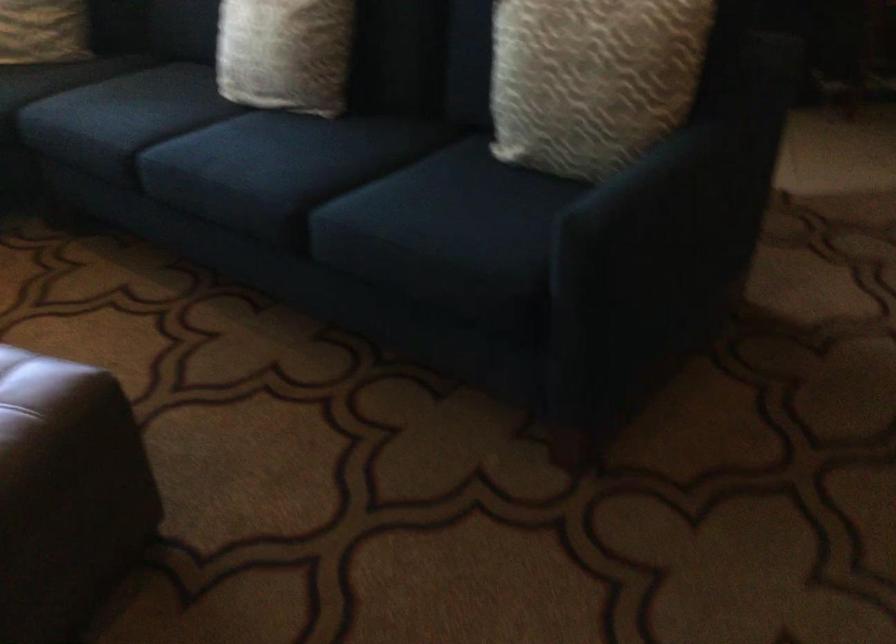
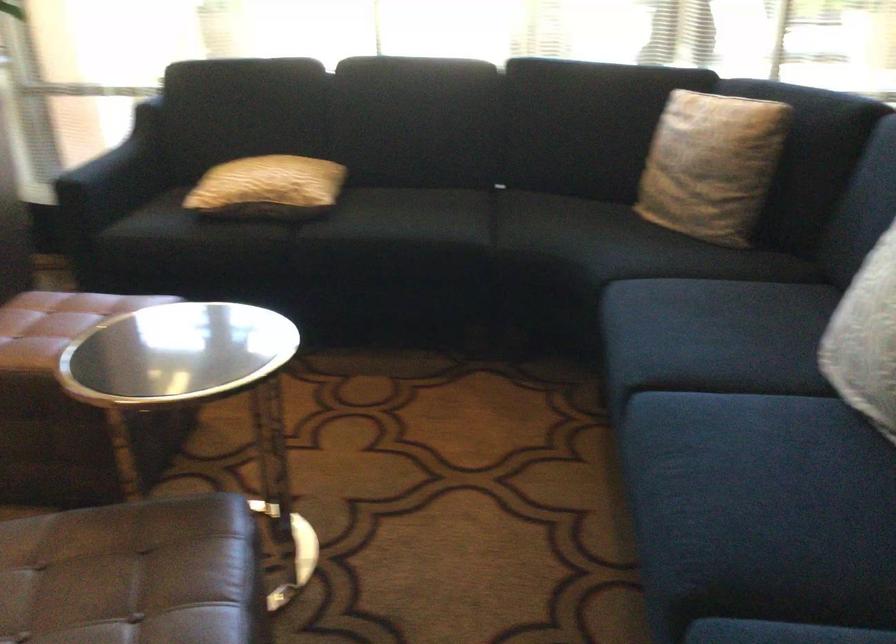
Question: How did the camera likely rotate?

Choices:
 (A) Left
 (B) Right
 (C) Up
 (D) Down

Answer: (A)